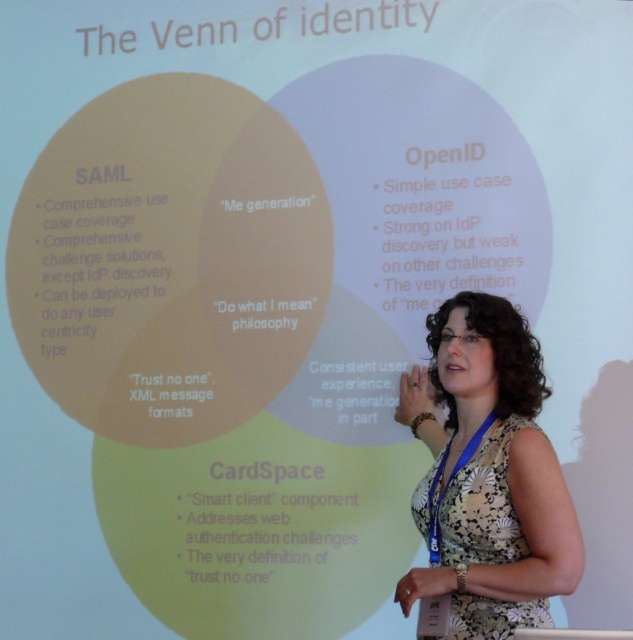
Where is the floral dress at center located in the image?

The floral dress at center is located at point (491, 477).